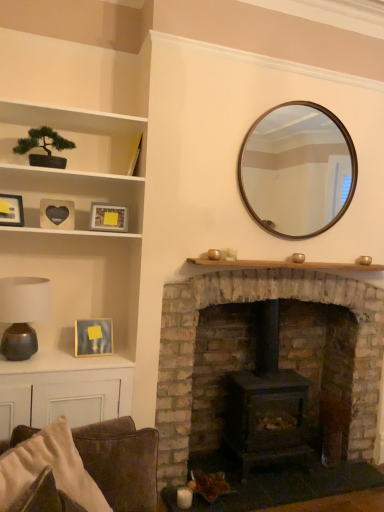
Question: Is green matte bonsai tree at upper left, which ranks as the 1th shelf in top-to-bottom order, thinner than matte brown table at lower left?

Choices:
 (A) no
 (B) yes

Answer: (A)

Question: Is green matte bonsai tree at upper left, the second shelf when ordered from bottom to top, located outside matte brown table at lower left?

Choices:
 (A) no
 (B) yes

Answer: (B)

Question: Is the surface of green matte bonsai tree at upper left, the second shelf when ordered from bottom to top, in direct contact with matte brown table at lower left?

Choices:
 (A) no
 (B) yes

Answer: (A)

Question: Could you tell me if green matte bonsai tree at upper left, positioned as the first shelf in left-to-right order, is turned towards matte brown table at lower left?

Choices:
 (A) no
 (B) yes

Answer: (A)

Question: Is matte brown table at lower left at the back of green matte bonsai tree at upper left, which ranks as the 1th shelf in top-to-bottom order?

Choices:
 (A) no
 (B) yes

Answer: (A)

Question: Does green matte bonsai tree at upper left, the second shelf when ordered from bottom to top, come in front of matte brown table at lower left?

Choices:
 (A) yes
 (B) no

Answer: (A)

Question: From a real-world perspective, is green matte bonsai tree at upper left, the second shelf positioned from the right, under white cotton pillow at lower left?

Choices:
 (A) no
 (B) yes

Answer: (A)

Question: Is green matte bonsai tree at upper left, positioned as the first shelf in left-to-right order, at the left side of white cotton pillow at lower left?

Choices:
 (A) yes
 (B) no

Answer: (A)

Question: Is green matte bonsai tree at upper left, positioned as the first shelf in left-to-right order, bigger than white cotton pillow at lower left?

Choices:
 (A) yes
 (B) no

Answer: (A)

Question: From the image's perspective, would you say green matte bonsai tree at upper left, which ranks as the 1th shelf in top-to-bottom order, is positioned over white cotton pillow at lower left?

Choices:
 (A) no
 (B) yes

Answer: (B)

Question: Does green matte bonsai tree at upper left, the second shelf positioned from the right, turn towards white cotton pillow at lower left?

Choices:
 (A) no
 (B) yes

Answer: (A)

Question: Is the position of green matte bonsai tree at upper left, the second shelf when ordered from bottom to top, less distant than that of white cotton pillow at lower left?

Choices:
 (A) no
 (B) yes

Answer: (A)

Question: Is green matte bonsai tree at upper left, the second shelf positioned from the right, inside brick fireplace at center?

Choices:
 (A) yes
 (B) no

Answer: (B)